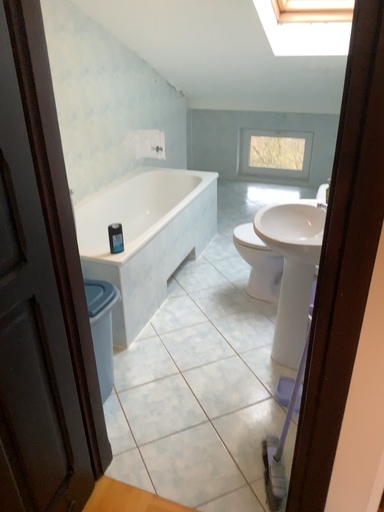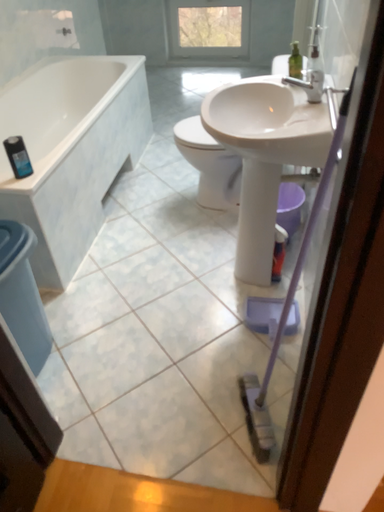
Question: How did the camera likely rotate when shooting the video?

Choices:
 (A) rotated downward
 (B) rotated upward

Answer: (A)